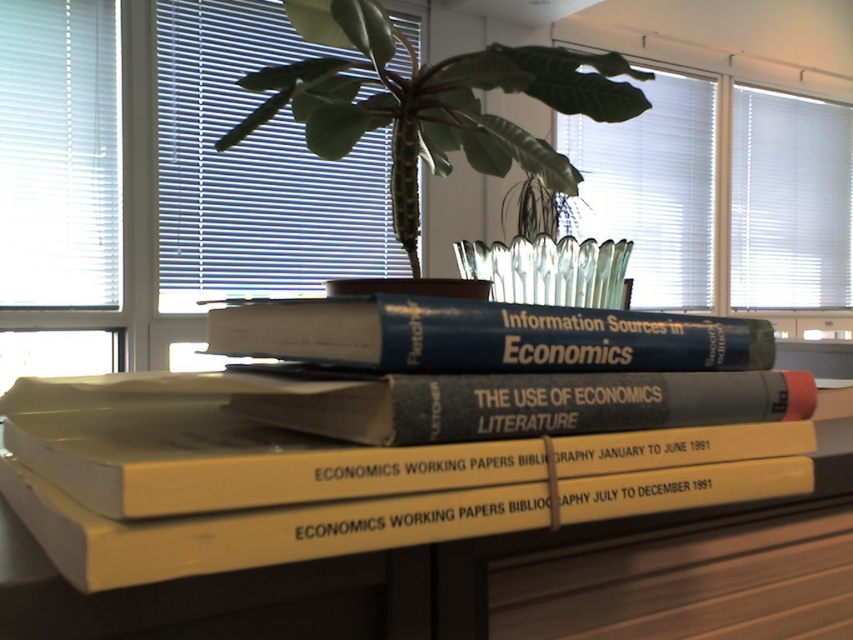
Question: Can you confirm if transparent glass window at upper center is thinner than yellow matte book at center?

Choices:
 (A) yes
 (B) no

Answer: (B)

Question: Where is transparent glass window at upper center located in relation to blue hardcover book at center in the image?

Choices:
 (A) above
 (B) below

Answer: (A)

Question: Which of these objects is positioned closest to the white plastic blinds at left?

Choices:
 (A) green leafy plant at upper center
 (B) white plastic blinds at upper left

Answer: (B)

Question: Does yellow paper at center appear on the right side of green leafy plant at upper center?

Choices:
 (A) no
 (B) yes

Answer: (B)

Question: Among these points, which one is farthest from the camera?

Choices:
 (A) (535, 337)
 (B) (103, 196)

Answer: (B)

Question: Which is nearer to the blue hardcover book at center?

Choices:
 (A) yellow paper at center
 (B) yellow matte book at center
 (C) transparent glass window at upper center

Answer: (B)